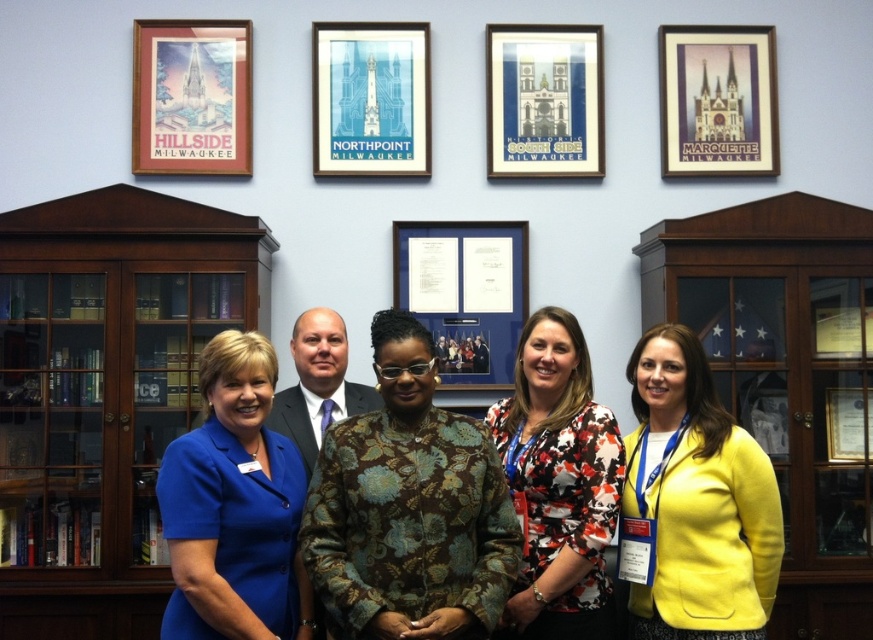
You are standing in front of the wall with architectural posters. You need to locate the yellow fabric jacket at lower right. Where exactly is it positioned relative to the posters?

The yellow fabric jacket at lower right is positioned at point (693,502) relative to the posters.

You are an interior designer arranging a meeting space. You need to ensure that the matte wood picture frame at upper left and the blue paper picture frame at upper center are visible to all attendees. Based on their current positions, which frame might be partially obscured by the other?

The matte wood picture frame at upper left is positioned over the blue paper picture frame at upper center, so the blue paper picture frame at upper center might be partially obscured by the matte wood picture frame at upper left.